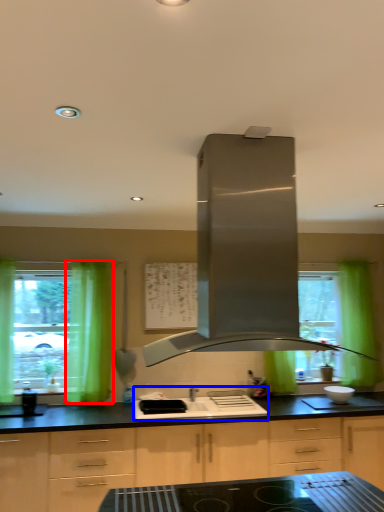
Question: Which point is closer to the camera, curtain (highlighted by a red box) or sink (highlighted by a blue box)?

Choices:
 (A) curtain
 (B) sink

Answer: (B)